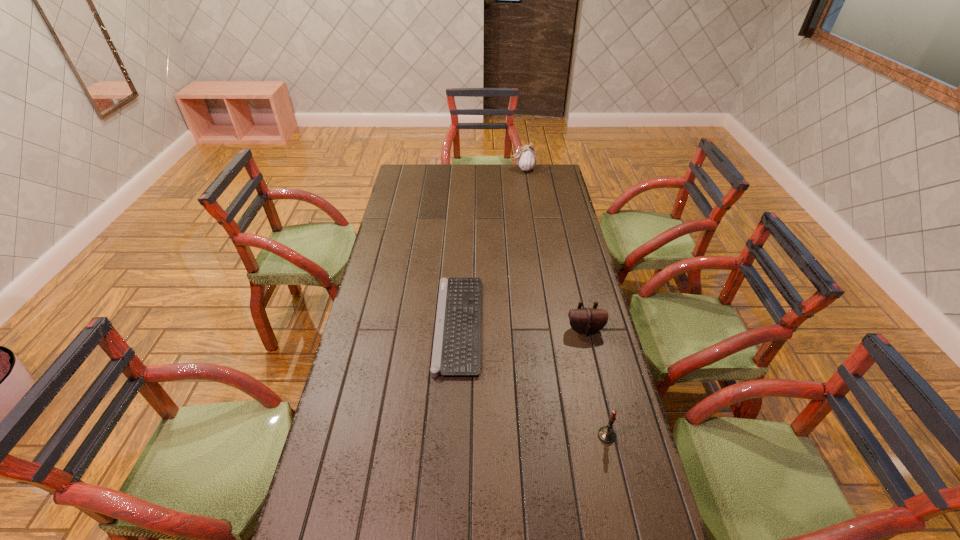
This screenshot has width=960, height=540. In order to click on the farthest object in this screenshot , I will do `click(526, 158)`.

Locate an element on the screen. The height and width of the screenshot is (540, 960). the left pouch is located at coordinates (526, 158).

Identify the location of the nearest object. (606, 434).

Find the location of a particular element. The image size is (960, 540). the shorter pouch is located at coordinates (586, 321).

The height and width of the screenshot is (540, 960). Identify the location of the right pouch. (586, 321).

The image size is (960, 540). What are the coordinates of `computer keyboard` in the screenshot? It's located at (456, 348).

Where is `the shortest object`? Image resolution: width=960 pixels, height=540 pixels. the shortest object is located at coordinates (456, 348).

Where is `vacant space located 0.070m on the front-facing side of the third object from right to left`? The width and height of the screenshot is (960, 540). vacant space located 0.070m on the front-facing side of the third object from right to left is located at coordinates (498, 169).

At what (x,y) coordinates should I click in order to perform the action: click on vacant space situated on the front-facing side of the third object from right to left. Please return your answer as a coordinate pair (x, y). The height and width of the screenshot is (540, 960). Looking at the image, I should click on (456, 169).

I want to click on vacant space situated on the front-facing side of the third object from right to left, so click(485, 169).